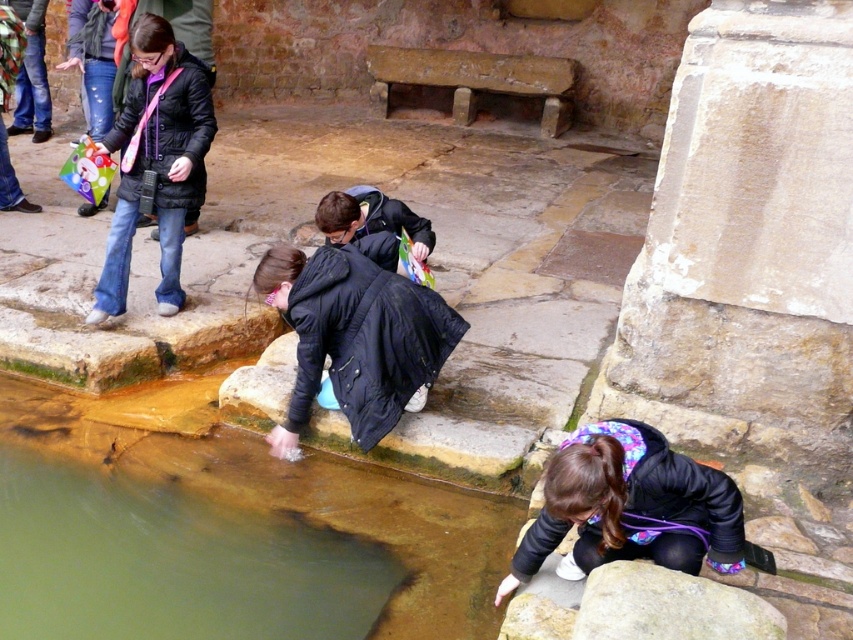
Image resolution: width=853 pixels, height=640 pixels. Describe the element at coordinates (289, 493) in the screenshot. I see `green stone puddle at lower center` at that location.

Is green stone puddle at lower center to the right of matte black jacket at upper left from the viewer's perspective?

Yes, green stone puddle at lower center is to the right of matte black jacket at upper left.

Identify the location of green stone puddle at lower center. (289, 493).

Does purple fleece jacket at lower center have a lesser width compared to smooth gray rock at lower right?

Incorrect, purple fleece jacket at lower center's width is not less than smooth gray rock at lower right's.

In the scene shown: Is purple fleece jacket at lower center positioned before smooth gray rock at lower right?

No, it is behind smooth gray rock at lower right.

Between point (555, 525) and point (611, 577), which one is positioned in front?

Point (611, 577) is in front.

This screenshot has width=853, height=640. In order to click on purple fleece jacket at lower center in this screenshot , I will do `click(630, 506)`.

Between black matte jacket at center and matte black jacket at upper left, which one appears on the right side from the viewer's perspective?

From the viewer's perspective, black matte jacket at center appears more on the right side.

Consider the image. Can you confirm if black matte jacket at center is shorter than matte black jacket at upper left?

Indeed, black matte jacket at center has a lesser height compared to matte black jacket at upper left.

Image resolution: width=853 pixels, height=640 pixels. What do you see at coordinates (354, 337) in the screenshot?
I see `black matte jacket at center` at bounding box center [354, 337].

Locate an element on the screen. This screenshot has width=853, height=640. black matte jacket at center is located at coordinates (354, 337).